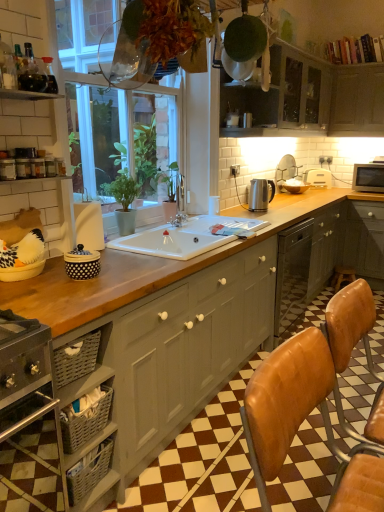
This screenshot has width=384, height=512. Identify the location of empty space that is to the right of satin silver kettle at counter top, which is the third appliance from front to back. (292, 208).